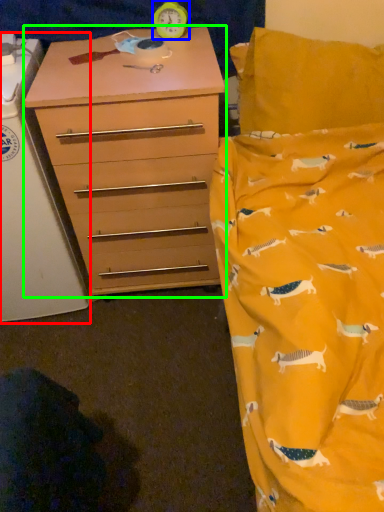
Question: Estimate the real-world distances between objects in this image. Which object is closer to changing table (highlighted by a red box), clock (highlighted by a blue box) or chest of drawers (highlighted by a green box)?

Choices:
 (A) clock
 (B) chest of drawers

Answer: (B)